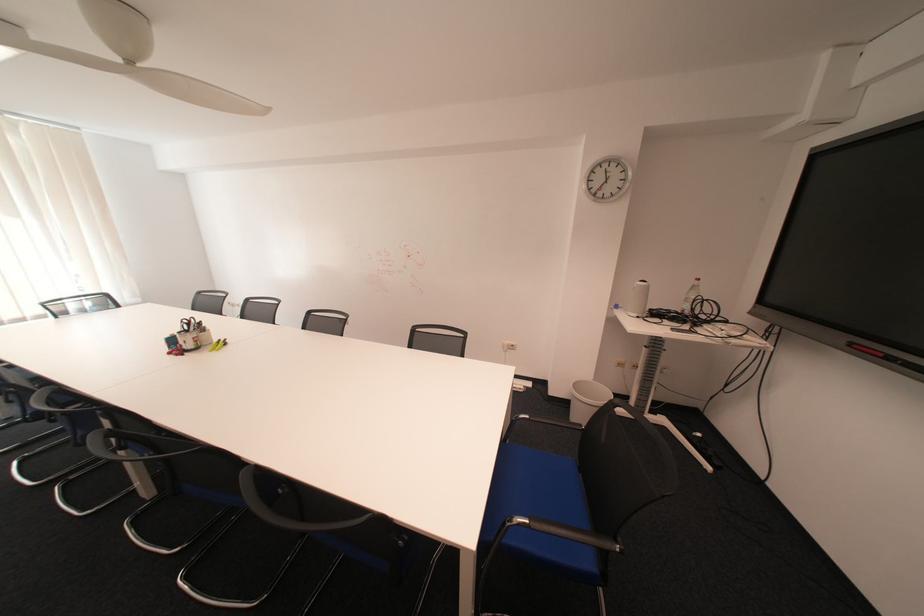
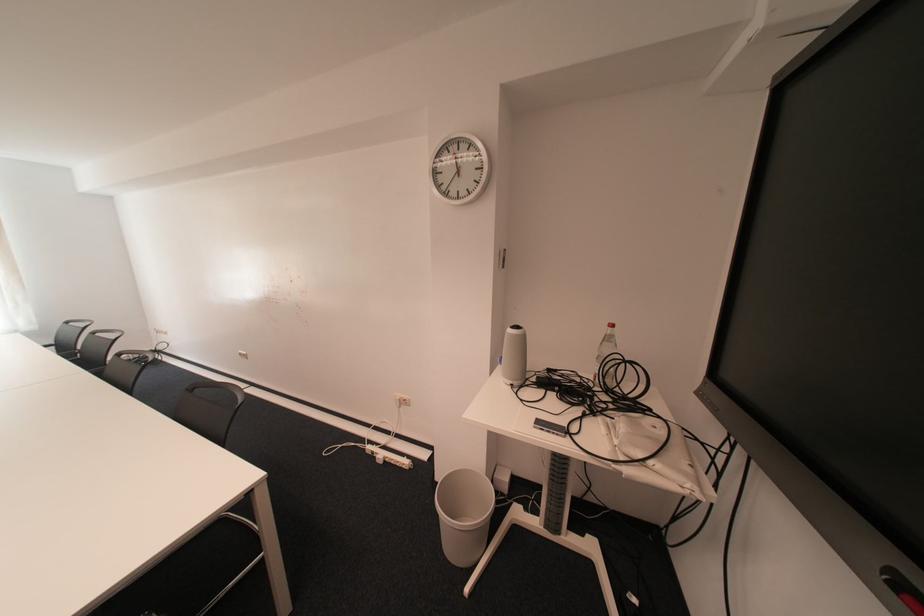
Where in the second image is the point corresponding to point 606,196 from the first image?

(457, 195)